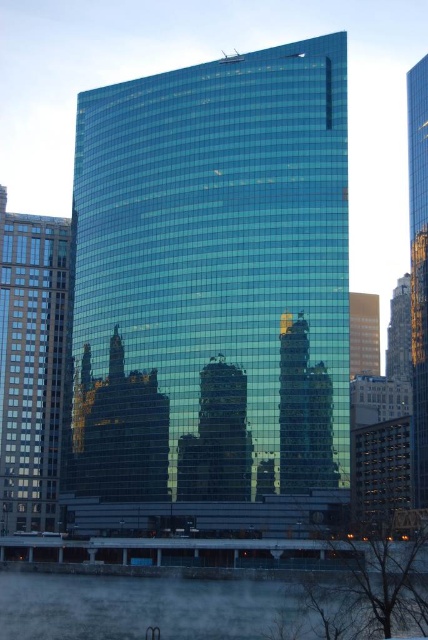
You are an architect reviewing the city layout. You notice the matte glass skyscraper at left and the shiny glass skyscraper at center. Which one appears closer to you from your viewing position?

The matte glass skyscraper at left appears closer because it is in front of the shiny glass skyscraper at center.

You are standing in a park across from the matte glass skyscraper at left. You want to take a photo that captures the entire building without any distortion. Considering the distance between you and the building, what is the minimum focal length required for your camera lens to achieve this?

To capture the entire matte glass skyscraper at left without distortion from a distance of 112.60 meters, the minimum focal length required would depend on the camera sensor size and the building height. However, a wide angle lens with a focal length between 24mm to 35mm is typically recommended for such scenarios to ensure the entire structure fits within the frame without distortion.

You are a city planner assessing the potential for a new public plaza between the shiny glass tower at center and the matte glass skyscraper at left. Given that the minimum required distance for such plazas is 60 feet, can the proposed plaza be constructed between these two buildings?

The shiny glass tower at center is 73.89 feet from the matte glass skyscraper at left, which exceeds the 60 feet requirement. Therefore, the proposed plaza can be constructed between these two buildings.